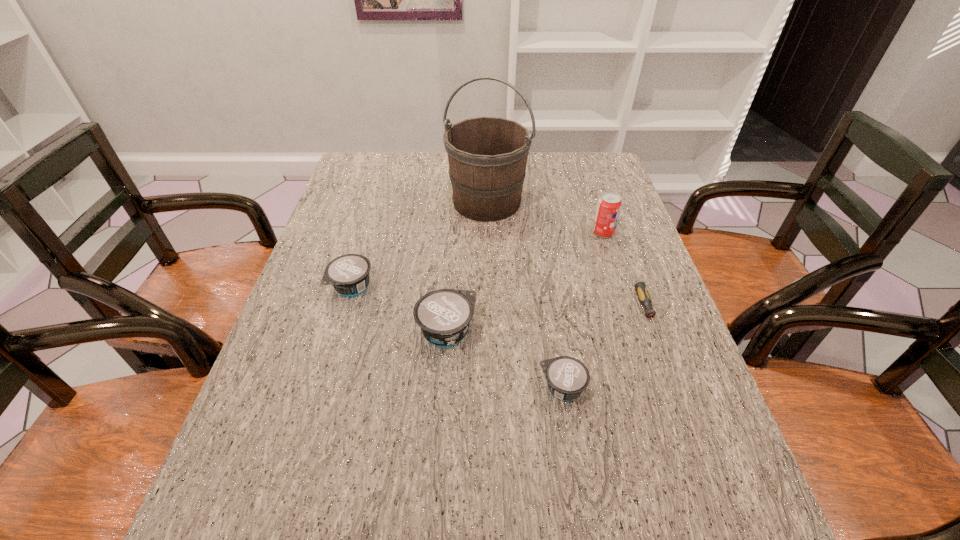
Please point a free position for a yogurt on the right. Please provide its 2D coordinates. Your answer should be formatted as a tuple, i.e. [(x, y)], where the tuple contains the x and y coordinates of a point satisfying the conditions above.

[(708, 459)]